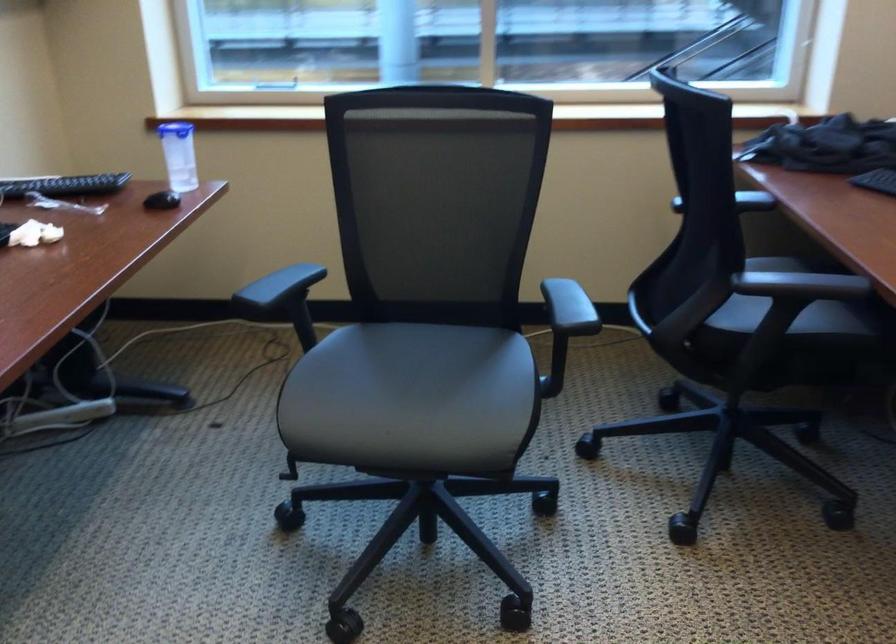
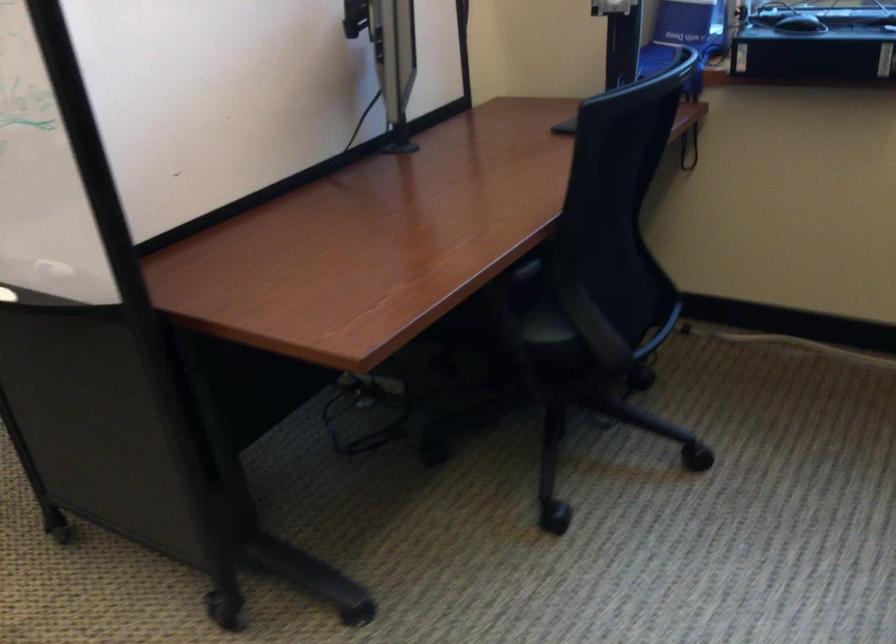
Question: The images are taken continuously from a first-person perspective. In which direction are you moving?

Choices:
 (A) Left
 (B) Right
 (C) Forward
 (D) Backward

Answer: (B)